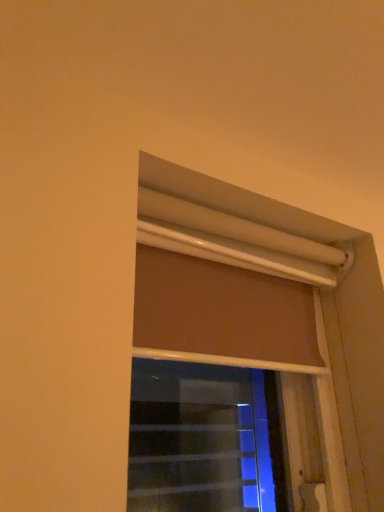
Describe the element at coordinates (246, 295) in the screenshot. I see `brown matte roller blind at upper center` at that location.

In order to click on brown matte roller blind at upper center in this screenshot , I will do `click(246, 295)`.

The height and width of the screenshot is (512, 384). I want to click on brown matte roller blind at upper center, so click(x=246, y=295).